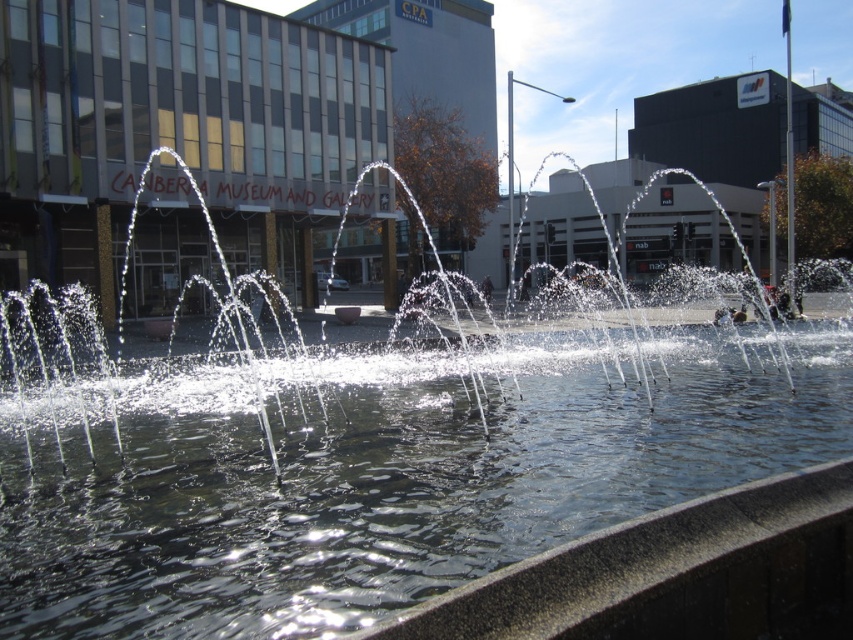
Question: Considering the relative positions of clear water at center and clear water fountain at center in the image provided, where is clear water at center located with respect to clear water fountain at center?

Choices:
 (A) below
 (B) above

Answer: (A)

Question: Which object is the farthest from the clear water fountain at center?

Choices:
 (A) transparent glass building at center
 (B) clear water at center

Answer: (A)

Question: Does clear water at center have a larger size compared to transparent glass building at center?

Choices:
 (A) no
 (B) yes

Answer: (A)

Question: Which point is closer to the camera taking this photo?

Choices:
 (A) (276, 445)
 (B) (466, 433)
 (C) (318, 192)

Answer: (A)

Question: Does clear water at center appear over transparent glass building at center?

Choices:
 (A) yes
 (B) no

Answer: (B)

Question: Which is farther from the clear water at center?

Choices:
 (A) transparent glass building at center
 (B) clear water fountain at center

Answer: (A)